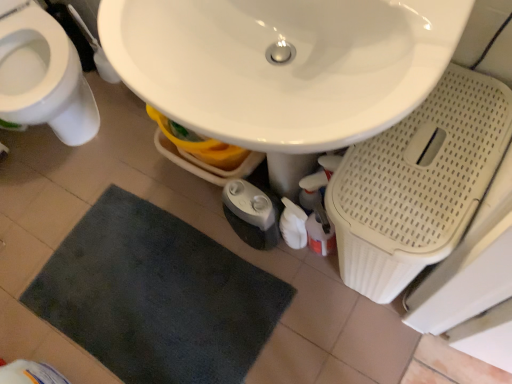
I want to click on blank area beneath white glossy toilet at left (from a real-world perspective), so click(87, 127).